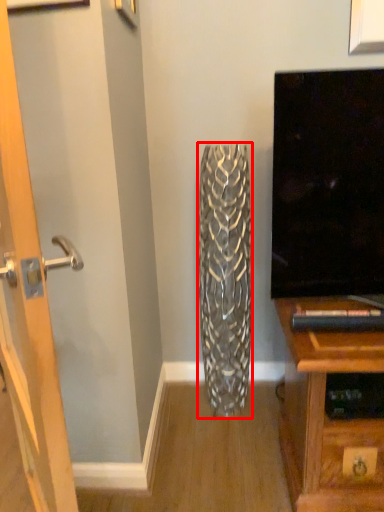
Question: Where is vase (annotated by the red box) located in relation to door in the image?

Choices:
 (A) right
 (B) left

Answer: (A)